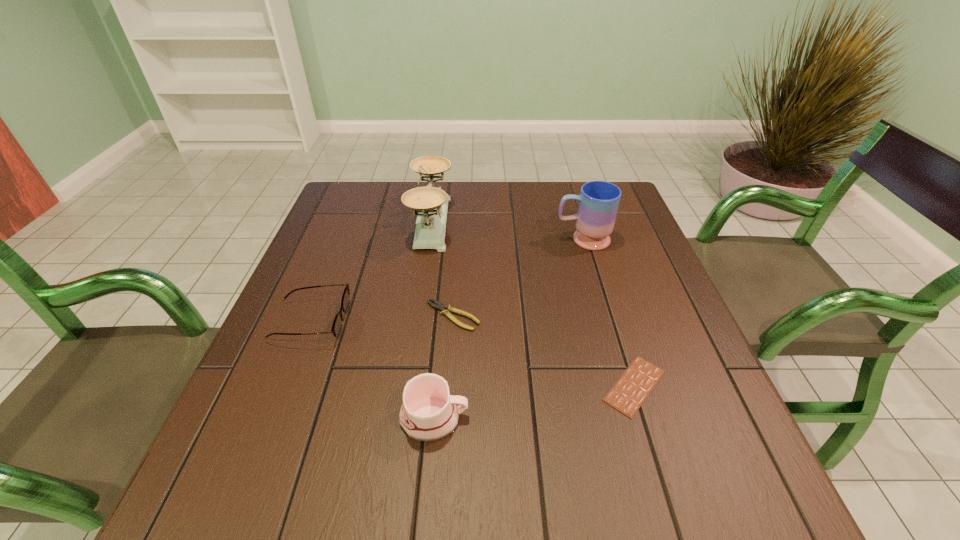
You are a GUI agent. You are given a task and a screenshot of the screen. Output one action in this format:
    pyautogui.click(x=<x>, y=<y>)
    Task: Click on the vacant space that satisfies the following two spatial constraints: 1. on the front-facing side of the scale; 2. on the left side of the pliers
    This screenshot has height=540, width=960.
    Given the screenshot: What is the action you would take?
    pyautogui.click(x=418, y=316)

The image size is (960, 540). What are the coordinates of `vacant space that satisfies the following two spatial constraints: 1. on the back side of the shortest object; 2. on the face of the fourth tallest object` in the screenshot? It's located at (614, 321).

The height and width of the screenshot is (540, 960). I want to click on vacant point that satisfies the following two spatial constraints: 1. on the face of the fourth tallest object; 2. on the right side of the chocolate bar, so click(x=285, y=386).

In order to click on free space that satisfies the following two spatial constraints: 1. on the side of the chocolate bar with the handle; 2. on the right side of the second tallest object in this screenshot , I will do [626, 386].

Where is `free space that satisfies the following two spatial constraints: 1. on the front side of the shortest object; 2. on the right side of the pliers`? free space that satisfies the following two spatial constraints: 1. on the front side of the shortest object; 2. on the right side of the pliers is located at coordinates (448, 386).